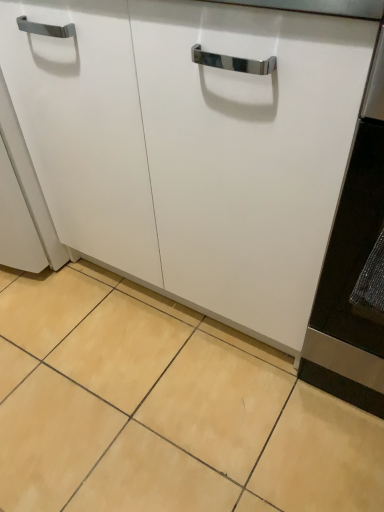
Image resolution: width=384 pixels, height=512 pixels. Describe the element at coordinates (163, 409) in the screenshot. I see `beige ceramic tile at lower center` at that location.

You are a GUI agent. You are given a task and a screenshot of the screen. Output one action in this format:
    pyautogui.click(x=<x>, y=<y>)
    Task: Click on the beige ceramic tile at lower center
    
    Given the screenshot: What is the action you would take?
    pyautogui.click(x=163, y=409)

Image resolution: width=384 pixels, height=512 pixels. What do you see at coordinates (192, 144) in the screenshot?
I see `white matte cabinet at center` at bounding box center [192, 144].

Image resolution: width=384 pixels, height=512 pixels. I want to click on white matte cabinet at center, so click(192, 144).

Image resolution: width=384 pixels, height=512 pixels. I want to click on beige ceramic tile at lower center, so click(x=163, y=409).

Between white matte cabinet at center and beige ceramic tile at lower center, which one appears on the left side from the viewer's perspective?

beige ceramic tile at lower center is more to the left.

Which is behind, white matte cabinet at center or beige ceramic tile at lower center?

beige ceramic tile at lower center is further away from the camera.

Which is nearer, (345, 98) or (275, 364)?

The point (345, 98) is closer to the camera.

From the image's perspective, is white matte cabinet at center above or below beige ceramic tile at lower center?

Clearly, from the image's perspective, white matte cabinet at center is above beige ceramic tile at lower center.

From a real-world perspective, is white matte cabinet at center below beige ceramic tile at lower center?

No.

Is white matte cabinet at center wider or thinner than beige ceramic tile at lower center?

In the image, white matte cabinet at center appears to be more narrow than beige ceramic tile at lower center.

Is white matte cabinet at center taller than beige ceramic tile at lower center?

Indeed, white matte cabinet at center has a greater height compared to beige ceramic tile at lower center.

Looking at the image, does white matte cabinet at center seem bigger or smaller compared to beige ceramic tile at lower center?

Clearly, white matte cabinet at center is larger in size than beige ceramic tile at lower center.

Would you say white matte cabinet at center contains beige ceramic tile at lower center?

That's incorrect, beige ceramic tile at lower center is not inside white matte cabinet at center.

Is white matte cabinet at center not near beige ceramic tile at lower center?

That's not correct — white matte cabinet at center is a little close to beige ceramic tile at lower center.

Looking at this image, could you tell me if white matte cabinet at center is facing beige ceramic tile at lower center?

Yes, white matte cabinet at center is turned towards beige ceramic tile at lower center.

How many degrees apart are the facing directions of white matte cabinet at center and beige ceramic tile at lower center?

The facing directions of white matte cabinet at center and beige ceramic tile at lower center are 0.153 degrees apart.

In the scene shown: Measure the distance between white matte cabinet at center and beige ceramic tile at lower center.

The distance of white matte cabinet at center from beige ceramic tile at lower center is 16.98 inches.

Identify the location of ceramic tile behind the white matte cabinet at center. (163, 409).

Considering the relative positions of beige ceramic tile at lower center and white matte cabinet at center in the image provided, is beige ceramic tile at lower center to the left or to the right of white matte cabinet at center?

beige ceramic tile at lower center is to the left of white matte cabinet at center.

Does beige ceramic tile at lower center come in front of white matte cabinet at center?

That is False.

Which is behind, point (155, 388) or point (344, 64)?

The point (155, 388) is farther.

From the image's perspective, which one is positioned lower, beige ceramic tile at lower center or white matte cabinet at center?

From the image's view, beige ceramic tile at lower center is below.

From a real-world perspective, is beige ceramic tile at lower center physically located above or below white matte cabinet at center?

beige ceramic tile at lower center is below white matte cabinet at center.

Which object is wider, beige ceramic tile at lower center or white matte cabinet at center?

Wider between the two is beige ceramic tile at lower center.

Does beige ceramic tile at lower center have a greater height compared to white matte cabinet at center?

Incorrect, the height of beige ceramic tile at lower center is not larger of that of white matte cabinet at center.

Considering the sizes of objects beige ceramic tile at lower center and white matte cabinet at center in the image provided, who is bigger, beige ceramic tile at lower center or white matte cabinet at center?

white matte cabinet at center is bigger.

Would you say beige ceramic tile at lower center contains white matte cabinet at center?

No, white matte cabinet at center is not a part of beige ceramic tile at lower center.

Is beige ceramic tile at lower center not near white matte cabinet at center?

No, there isn't a large distance between beige ceramic tile at lower center and white matte cabinet at center.

Is beige ceramic tile at lower center aimed at white matte cabinet at center?

No, beige ceramic tile at lower center is not turned towards white matte cabinet at center.

The height and width of the screenshot is (512, 384). In order to click on ceramic tile below the white matte cabinet at center (from the image's perspective) in this screenshot , I will do `click(163, 409)`.

At what (x,y) coordinates should I click in order to perform the action: click on cabinetry above the beige ceramic tile at lower center (from the image's perspective). Please return your answer as a coordinate pair (x, y). The height and width of the screenshot is (512, 384). Looking at the image, I should click on (192, 144).

Identify the location of cabinetry in front of the beige ceramic tile at lower center. (192, 144).